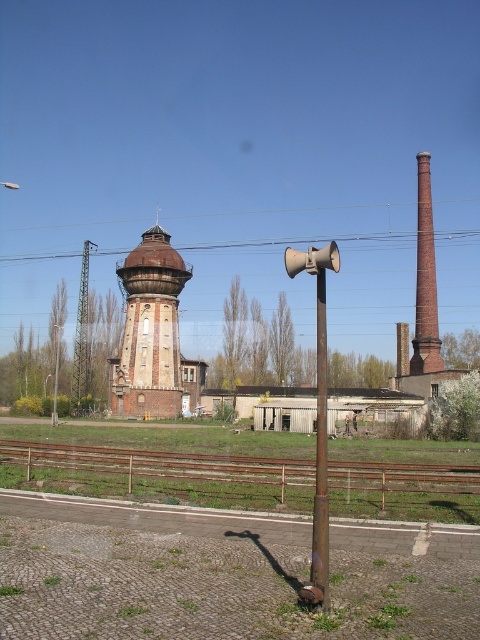
You are a maintenance worker assessing the scene. You need to determine which object, the rusty metal train track at center or the metallic pole at center, is taller. Based on the scene, which one is taller?

The metallic pole at center is taller than the rusty metal train track at center.

You are a drone operator trying to fly a drone from the metallic pole at center to the red brick chimney at right. Based on the scene, which object is taller, and why does this matter for your flight path?

The red brick chimney at right is taller than the metallic pole at center. This means the drone must ascend to a higher altitude to safely navigate from the metallic pole at center to the red brick chimney at right, ensuring it clears any potential obstacles between them.

You are an architect designing a new park layout. You need to place a new bench between the red brick chimney at right and the brick chimney at center right. Which chimney should the bench be closer to if you want it to be equidistant from both chimneys?

The bench should be placed closer to the brick chimney at center right because the red brick chimney at right is wider, so the midpoint between them would require the bench to be nearer to the narrower chimney to maintain equal distance.